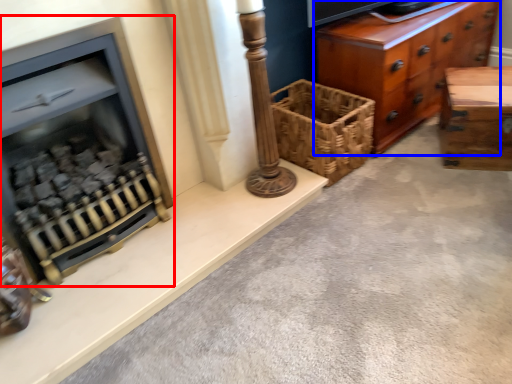
Question: Among these objects, which one is nearest to the camera, fireplace (highlighted by a red box) or chest of drawers (highlighted by a blue box)?

Choices:
 (A) fireplace
 (B) chest of drawers

Answer: (A)